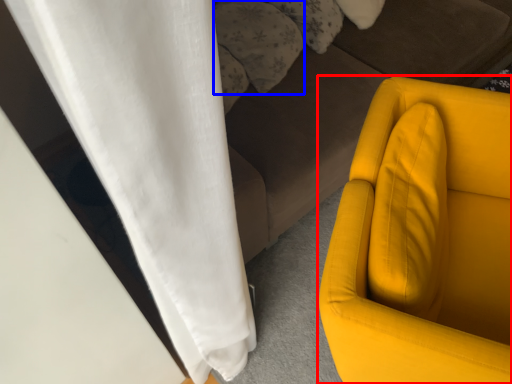
Question: Which object is closer to the camera taking this photo, furniture (highlighted by a red box) or pillow (highlighted by a blue box)?

Choices:
 (A) furniture
 (B) pillow

Answer: (A)